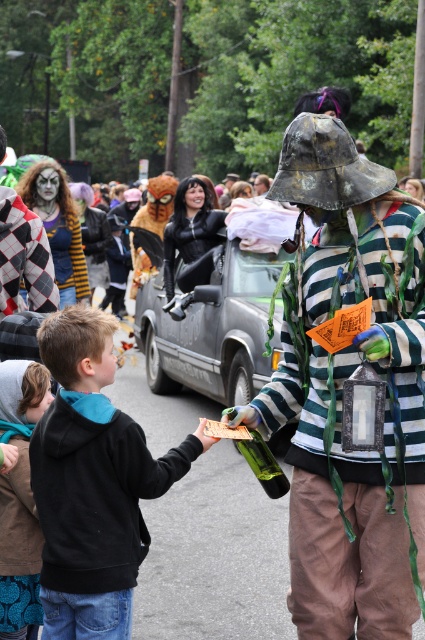
You are organizing a parade route and need to know if the rusty metal lantern at center and the black matte car at center can fit side by side in a 2.5 meter wide path. Can they both fit?

The rusty metal lantern at center occupies less space than the black matte car at center. However, without knowing the exact dimensions of each object, it is impossible to determine if they can fit side by side in a 2.5 meter wide path. Additional measurements are required.

You are driving a car that is 4.5 meters long. You see the rusty metal lantern at center and the black matte car at center in the street ahead. Can your car fit between them without touching either?

The rusty metal lantern at center and the black matte car at center are 5.10 meters apart from each other. Since your car is 4.5 meters long, it can fit between them as the distance is greater than the car length.